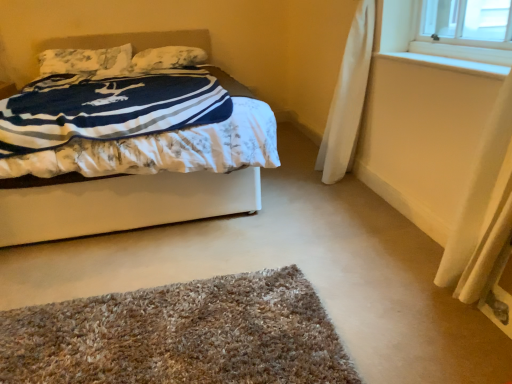
Question: Based on their sizes in the image, would you say white fabric bed at center is bigger or smaller than white soft pillow at upper center, the second pillow positioned from the left?

Choices:
 (A) small
 (B) big

Answer: (B)

Question: Is point (74, 235) positioned closer to the camera than point (174, 46)?

Choices:
 (A) closer
 (B) farther

Answer: (A)

Question: Considering the real-world distances, which object is closest to the brown shaggy rug at lower center?

Choices:
 (A) white soft pillow at upper center, which ranks as the 1th pillow in right-to-left order
 (B) white wood at upper right
 (C) white fabric bed at center
 (D) fluffy white pillow at upper left, positioned as the 1th pillow in left-to-right order

Answer: (C)

Question: Considering the real-world distances, which object is closest to the brown shaggy rug at lower center?

Choices:
 (A) fluffy white pillow at upper left, positioned as the 1th pillow in left-to-right order
 (B) white fabric bed at center
 (C) white wood at upper right
 (D) white soft pillow at upper center, the second pillow positioned from the left

Answer: (B)